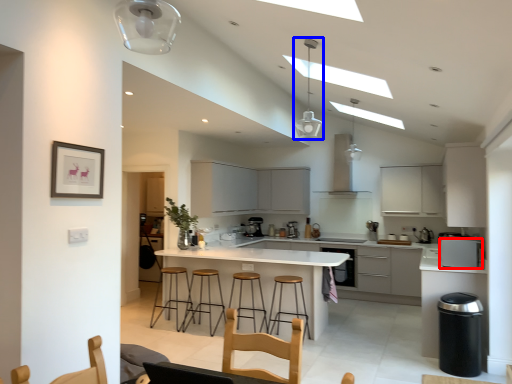
Question: Which point is further to the camera, kitchen appliance (highlighted by a red box) or light fixture (highlighted by a blue box)?

Choices:
 (A) kitchen appliance
 (B) light fixture

Answer: (A)